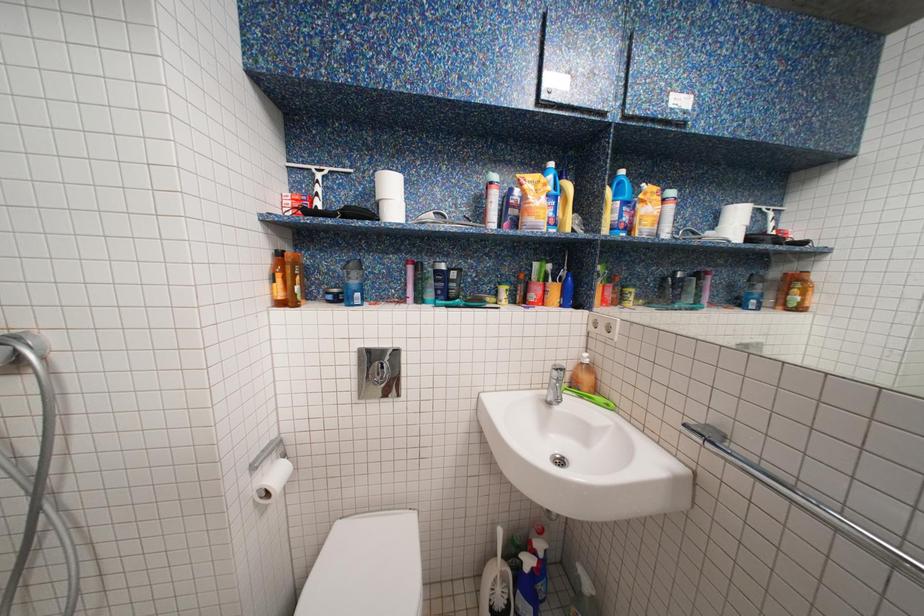
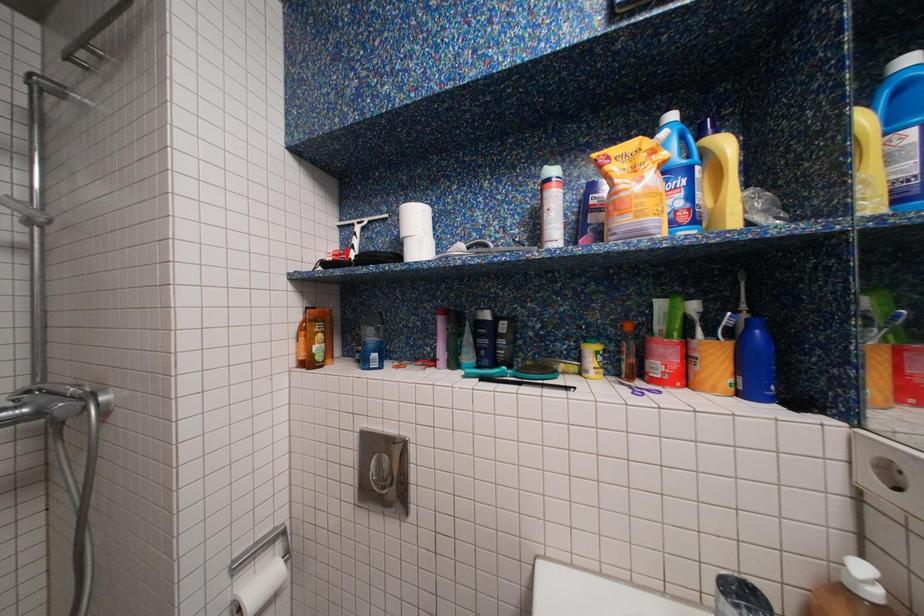
Question: The camera is either moving clockwise (left) or counter-clockwise (right) around the object. The first image is from the beginning of the video and the second image is from the end. Is the camera moving left or right when shooting the video?

Choices:
 (A) Left
 (B) Right

Answer: (B)